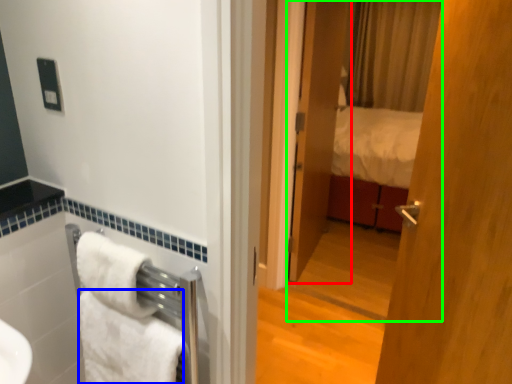
Question: Based on their relative distances, which object is nearer to door (highlighted by a red box)? Choose from towel/napkin (highlighted by a blue box) and mirror (highlighted by a green box).

Choices:
 (A) towel/napkin
 (B) mirror

Answer: (B)